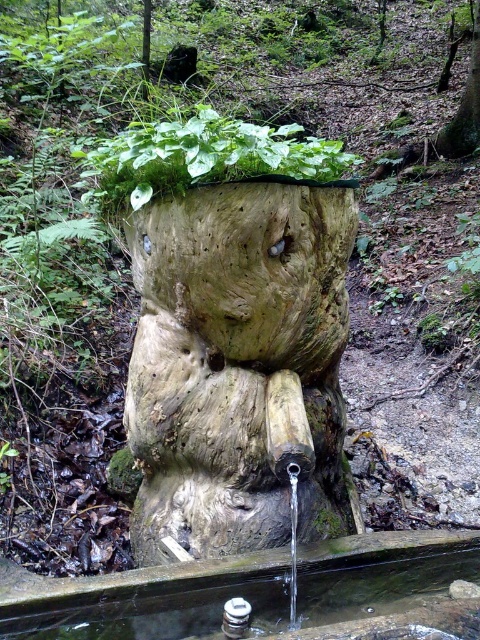
Who is positioned more to the right, natural wood fountain at center or rough bark tree trunk at upper center?

Positioned to the right is rough bark tree trunk at upper center.

Between point (268, 465) and point (477, 144), which one is positioned behind?

Positioned behind is point (477, 144).

Identify the location of natural wood fountain at center. The width and height of the screenshot is (480, 640). (239, 364).

Measure the distance between clear glass water at lower center and rough bark tree trunk at upper center.

clear glass water at lower center is 17.37 feet away from rough bark tree trunk at upper center.

Is clear glass water at lower center behind rough bark tree trunk at upper center?

No, clear glass water at lower center is closer to the viewer.

Is point (204, 580) positioned behind point (475, 116)?

No, (204, 580) is closer to viewer.

This screenshot has width=480, height=640. In order to click on clear glass water at lower center in this screenshot , I will do `click(263, 593)`.

Does point (169, 284) come behind point (156, 627)?

Yes, it is.

Is natural wood fountain at center to the right of clear glass water at lower center from the viewer's perspective?

No, natural wood fountain at center is not to the right of clear glass water at lower center.

Between point (244, 547) and point (359, 611), which one is positioned behind?

The point (244, 547) is more distant.

Where is `natural wood fountain at center`? This screenshot has width=480, height=640. natural wood fountain at center is located at coordinates (239, 364).